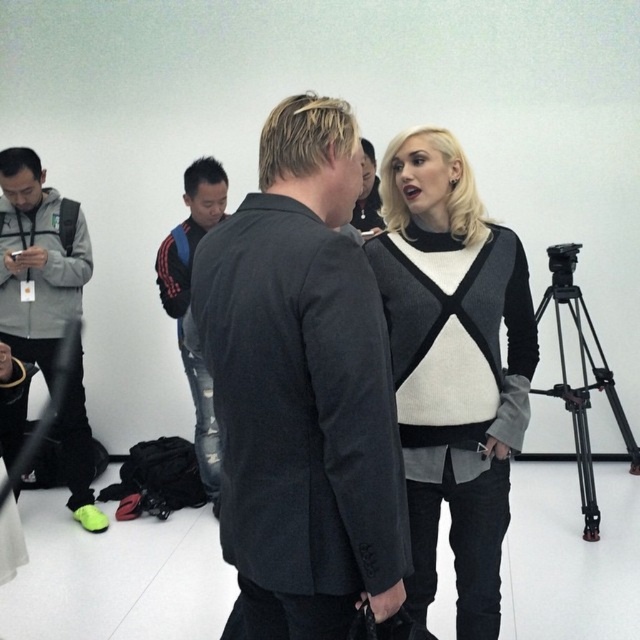
You are an interior designer trying to arrange furniture in this studio. You have a sofa that is 1.2 meters wide. You want to place it between the knit sweater at center and the black metal tripod at right. Is there enough space?

The knit sweater at center has a lesser width compared to black metal tripod at right. Since the sofa is 1.2 meters wide, the space between them should accommodate it as long as the distance between the two objects is at least 1.2 meters. However, the description only provides information about their widths, not the distance between them. Without knowing the actual distance, it is impossible to determine if the sofa will fit.

You are standing at the camera position in the studio. You see two points marked in the image. The first point is at coordinates point (460, 152) and the second point is at point (588, 355). Which point is closer to you?

Point (460, 152) is in front of point (588, 355), so it is closer to you.